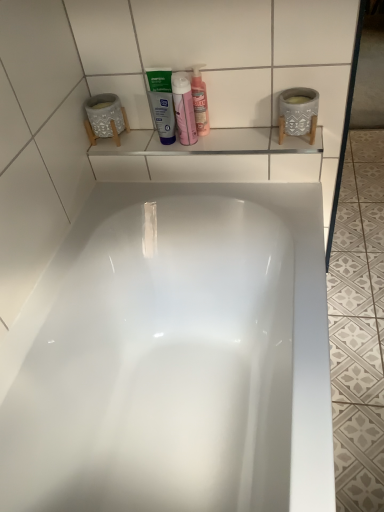
Identify the location of white matte tube at center. The width and height of the screenshot is (384, 512). (162, 103).

In order to click on translucent plastic bottle at upper center in this screenshot , I will do `click(184, 109)`.

Are white matte tube at center and translucent plastic bottle at upper center making contact?

Yes, white matte tube at center is with translucent plastic bottle at upper center.

Could you tell me if white matte tube at center is facing translucent plastic bottle at upper center?

No, white matte tube at center does not turn towards translucent plastic bottle at upper center.

From a real-world perspective, does white matte tube at center sit lower than translucent plastic bottle at upper center?

Indeed, from a real-world perspective, white matte tube at center is positioned beneath translucent plastic bottle at upper center.

Locate an element on the screen. cleaning product on the right side of white matte tube at center is located at coordinates click(x=184, y=109).

From the picture: From a real-world perspective, is white matte tube at center physically below white glossy bathtub at center?

No, from a real-world perspective, white matte tube at center is not beneath white glossy bathtub at center.

In the image, is white matte tube at center on the left side or the right side of white glossy bathtub at center?

white matte tube at center is to the left of white glossy bathtub at center.

From the picture: How far apart are white matte tube at center and white glossy bathtub at center?

Answer: A distance of 23.14 inches exists between white matte tube at center and white glossy bathtub at center.

Which is behind, white matte tube at center or white glossy bathtub at center?

white matte tube at center is further from the camera.

From a real-world perspective, between translucent plastic bottle at upper center and white matte tube at center, who is vertically higher?

translucent plastic bottle at upper center.

Which is less distant, (180,127) or (157,91)?

Point (180,127) is positioned farther from the camera compared to point (157,91).

Can you confirm if translucent plastic bottle at upper center is positioned to the left of white matte tube at center?

No, translucent plastic bottle at upper center is not to the left of white matte tube at center.

Is translucent plastic bottle at upper center next to white matte tube at center and touching it?

Yes, translucent plastic bottle at upper center is touching white matte tube at center.

Where is `cleaning product above the white glossy bathtub at center (from a real-world perspective)`? cleaning product above the white glossy bathtub at center (from a real-world perspective) is located at coordinates (184, 109).

From the image's perspective, which one is positioned higher, translucent plastic bottle at upper center or white glossy bathtub at center?

From the image's view, translucent plastic bottle at upper center is above.

Does translucent plastic bottle at upper center have a greater width compared to white glossy bathtub at center?

No.

Is white glossy bathtub at center located outside translucent plastic bottle at upper center?

Yes, white glossy bathtub at center is outside of translucent plastic bottle at upper center.

From the picture: Can you confirm if white glossy bathtub at center is thinner than translucent plastic bottle at upper center?

In fact, white glossy bathtub at center might be wider than translucent plastic bottle at upper center.

Is white glossy bathtub at center with translucent plastic bottle at upper center?

No, white glossy bathtub at center is not touching translucent plastic bottle at upper center.

How many degrees apart are the facing directions of white glossy bathtub at center and translucent plastic bottle at upper center?

They differ by 90.1 degrees in their facing directions.

Could white matte tube at center be considered to be inside white glossy bathtub at center?

Definitely not — white matte tube at center is not inside white glossy bathtub at center.

From the image's perspective, does white glossy bathtub at center appear lower than white matte tube at center?

Yes, from the image's perspective, white glossy bathtub at center is below white matte tube at center.

Considering the sizes of white glossy bathtub at center and white matte tube at center in the image, is white glossy bathtub at center wider or thinner than white matte tube at center?

In the image, white glossy bathtub at center appears to be wider than white matte tube at center.

How much distance is there between white glossy bathtub at center and white matte tube at center?

The distance of white glossy bathtub at center from white matte tube at center is 58.77 centimeters.

The height and width of the screenshot is (512, 384). Identify the location of mouthwash below the translucent plastic bottle at upper center (from the image's perspective). (162, 103).

The height and width of the screenshot is (512, 384). In the image, there is a white matte tube at center. What are the coordinates of `bathtub below it (from a real-world perspective)` in the screenshot? It's located at (175, 357).

Based on their spatial positions, is translucent plastic bottle at upper center or white glossy bathtub at center further from white matte tube at center?

white glossy bathtub at center is further to white matte tube at center.

When comparing their distances from white matte tube at center, does white glossy bathtub at center or translucent plastic bottle at upper center seem closer?

translucent plastic bottle at upper center is closer to white matte tube at center.

When comparing their distances from white glossy bathtub at center, does translucent plastic bottle at upper center or white matte tube at center seem further?

translucent plastic bottle at upper center is further to white glossy bathtub at center.

When comparing their distances from translucent plastic bottle at upper center, does white matte tube at center or white glossy bathtub at center seem closer?

white matte tube at center.

When comparing their distances from translucent plastic bottle at upper center, does white glossy bathtub at center or white matte tube at center seem further?

white glossy bathtub at center lies further to translucent plastic bottle at upper center than the other object.

Estimate the real-world distances between objects in this image. Which object is closer to white glossy bathtub at center, white matte tube at center or translucent plastic bottle at upper center?

Among the two, white matte tube at center is located nearer to white glossy bathtub at center.

Where is `mouthwash that lies between translucent plastic bottle at upper center and white glossy bathtub at center from top to bottom`? The image size is (384, 512). mouthwash that lies between translucent plastic bottle at upper center and white glossy bathtub at center from top to bottom is located at coordinates (162, 103).